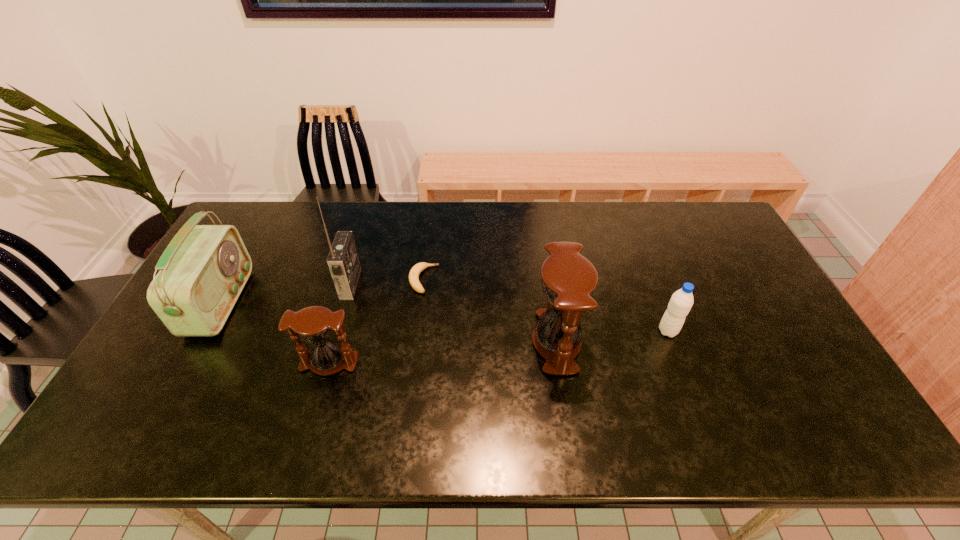
At what (x,y) coordinates should I click in order to perform the action: click on the shorter hourglass. Please return your answer as a coordinate pair (x, y). Looking at the image, I should click on click(314, 324).

The width and height of the screenshot is (960, 540). I want to click on the right hourglass, so click(568, 279).

I want to click on the second object from right to left, so click(568, 279).

Image resolution: width=960 pixels, height=540 pixels. Identify the location of the fourth object from left to right. point(414,273).

Image resolution: width=960 pixels, height=540 pixels. Find the location of `the shortest object`. the shortest object is located at coordinates (414, 273).

Identify the location of the left radio receiver. This screenshot has width=960, height=540. (203, 270).

The height and width of the screenshot is (540, 960). Identify the location of the leftmost object. (203, 270).

At what (x,y) coordinates should I click in order to perform the action: click on the rightmost object. Please return your answer as a coordinate pair (x, y). This screenshot has height=540, width=960. Looking at the image, I should click on (682, 300).

Find the location of `the tallest object`. the tallest object is located at coordinates (343, 263).

At what (x,y) coordinates should I click in order to perform the action: click on the taller radio receiver. Please return your answer as a coordinate pair (x, y). Looking at the image, I should click on (343, 263).